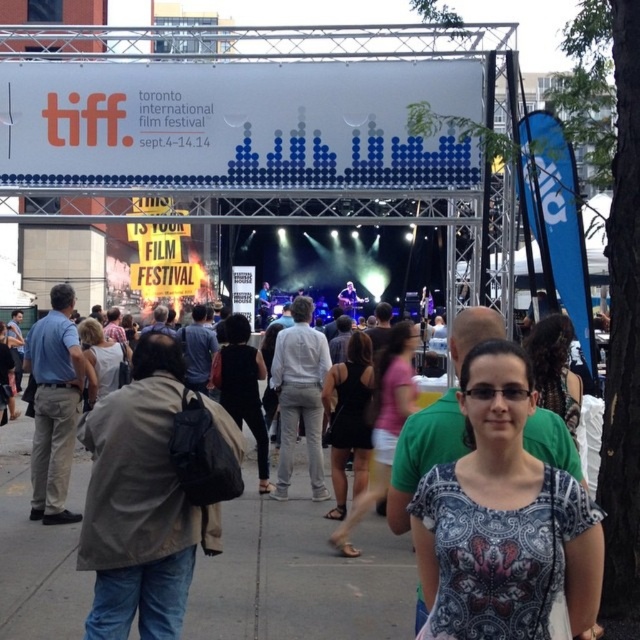
Can you confirm if matte black sunglasses at center is thinner than matte black dress at center?

Yes, matte black sunglasses at center is thinner than matte black dress at center.

Does matte black sunglasses at center have a smaller size compared to matte black dress at center?

Yes, matte black sunglasses at center is smaller than matte black dress at center.

Which is behind, point (544, 320) or point (93, 381)?

The point (93, 381) is more distant.

Where is `matte black sunglasses at center`? matte black sunglasses at center is located at coordinates [x=554, y=369].

Is black dress at center behind matte black dress at center?

No, it is not.

Does point (333, 508) come closer to viewer compared to point (125, 346)?

Yes.

Who is more distant from viewer, (x=340, y=502) or (x=90, y=328)?

The point (x=90, y=328) is more distant.

Find the location of a particular element. black dress at center is located at coordinates (348, 419).

Which of these two, matte black tank top at center or matte black sunglasses at center, stands taller?

Standing taller between the two is matte black tank top at center.

You are a GUI agent. You are given a task and a screenshot of the screen. Output one action in this format:
    pyautogui.click(x=<x>, y=<y>)
    Task: Click on the matte black tank top at center
    The image size is (640, 640).
    Given the screenshot: What is the action you would take?
    pyautogui.click(x=384, y=424)